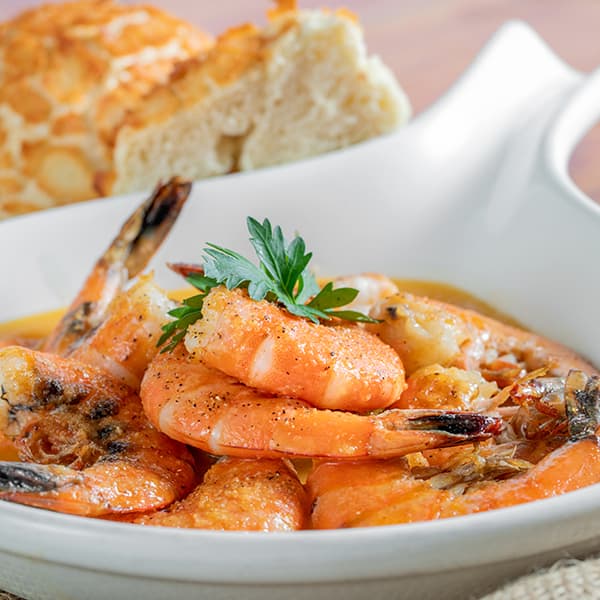
Locate an element on the screen. soup bowl handle is located at coordinates click(x=535, y=96).